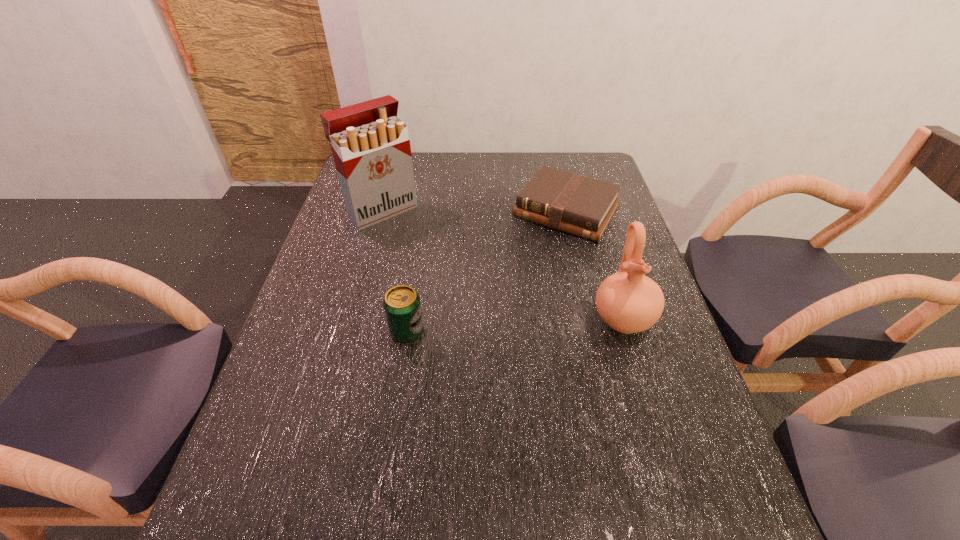
Where is `beer can`? beer can is located at coordinates (401, 303).

At what (x,y) coordinates should I click in order to perform the action: click on pottery. Please return your answer as a coordinate pair (x, y). Looking at the image, I should click on (630, 302).

Where is `cigarette case`? The width and height of the screenshot is (960, 540). cigarette case is located at coordinates (371, 148).

This screenshot has height=540, width=960. I want to click on the shortest object, so click(x=576, y=204).

You are a GUI agent. You are given a task and a screenshot of the screen. Output one action in this format:
    pyautogui.click(x=<x>, y=<y>)
    Task: Click on the vacant space located on the back of the beer can
    The height and width of the screenshot is (540, 960).
    Given the screenshot: What is the action you would take?
    pyautogui.click(x=416, y=274)

Locate an element on the screen. Image resolution: width=960 pixels, height=540 pixels. vacant space located on the spout of the third shortest object is located at coordinates (660, 442).

Image resolution: width=960 pixels, height=540 pixels. I want to click on vacant space located 0.250m with the lid open on the cigarette case, so click(445, 270).

You are a GUI agent. You are given a task and a screenshot of the screen. Output one action in this format:
    pyautogui.click(x=<x>, y=<y>)
    Task: Click on the vacant space positioned with the lid open on the cigarette case
    
    Given the screenshot: What is the action you would take?
    (x=478, y=302)

Image resolution: width=960 pixels, height=540 pixels. Identify the location of vacant space positioned 0.390m with the lid open on the cigarette case. (476, 299).

This screenshot has width=960, height=540. I want to click on vacant space located on the spine side of the shortest object, so click(530, 261).